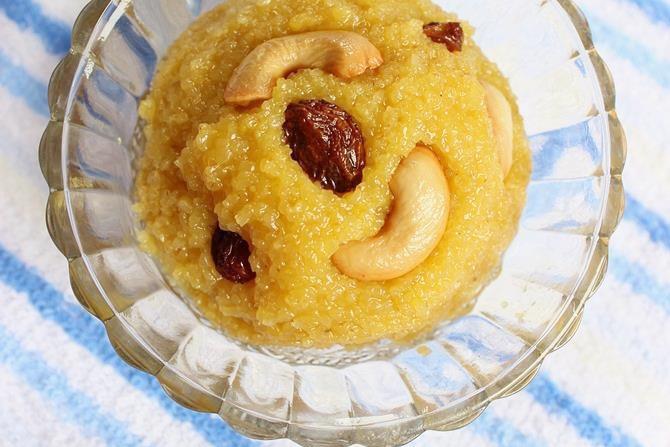
This screenshot has width=670, height=447. What are the coordinates of `table place mat` in the screenshot? It's located at (65, 328).